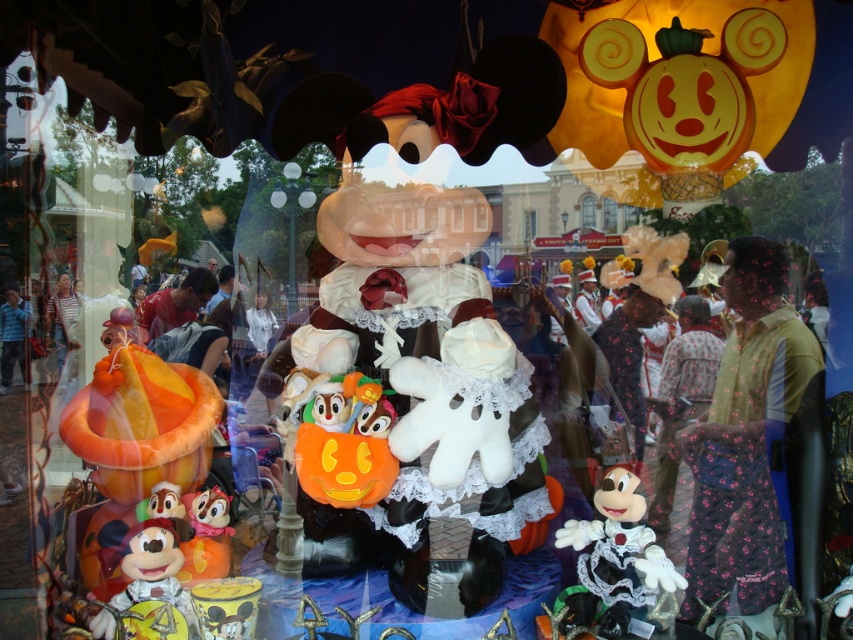
Between white plush toy at center and matte orange plush toy at lower left, which one is positioned lower?

white plush toy at center

Does white plush toy at center have a greater height compared to matte orange plush toy at lower left?

Correct, white plush toy at center is much taller as matte orange plush toy at lower left.

You are a GUI agent. You are given a task and a screenshot of the screen. Output one action in this format:
    pyautogui.click(x=<x>, y=<y>)
    Task: Click on the white plush toy at center
    
    Given the screenshot: What is the action you would take?
    pyautogui.click(x=614, y=563)

At what (x,y) coordinates should I click in order to perform the action: click on white plush toy at center. Please return your answer as a coordinate pair (x, y). The image size is (853, 640). Looking at the image, I should click on (614, 563).

This screenshot has width=853, height=640. Describe the element at coordinates (614, 563) in the screenshot. I see `white plush toy at center` at that location.

Identify the location of white plush toy at center. This screenshot has width=853, height=640. (614, 563).

The height and width of the screenshot is (640, 853). I want to click on white plush toy at center, so click(x=614, y=563).

Does point (136, 532) come closer to viewer compared to point (212, 515)?

Yes, point (136, 532) is closer to viewer.

Is point (170, 596) positioned behind point (206, 493)?

No, it is in front of (206, 493).

Who is more distant from viewer, (x=183, y=556) or (x=228, y=524)?

The point (x=228, y=524) is behind.

At what (x,y) coordinates should I click in order to perform the action: click on matte yellow plush toy at lower left. Please return your answer as a coordinate pair (x, y). Looking at the image, I should click on (154, 570).